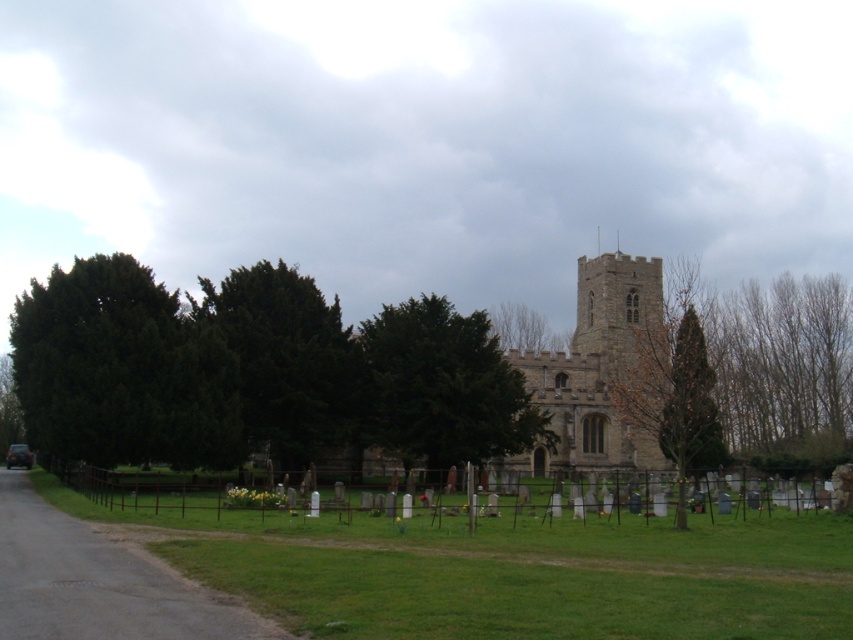
Does green leafy tree at center appear over bare wood at right?

Correct, green leafy tree at center is located above bare wood at right.

Which is below, green leafy tree at center or bare wood at right?

Positioned lower is bare wood at right.

This screenshot has width=853, height=640. I want to click on green leafy tree at center, so click(442, 387).

Identify the location of green leafy tree at center. This screenshot has height=640, width=853. (442, 387).

Between gray stone church at center and green leafy tree at left, which one appears on the right side from the viewer's perspective?

Positioned to the right is gray stone church at center.

The width and height of the screenshot is (853, 640). What do you see at coordinates (599, 371) in the screenshot?
I see `gray stone church at center` at bounding box center [599, 371].

Identify the location of gray stone church at center. (599, 371).

Is gray stone church at center positioned behind dark green textured tree at center?

No, it is in front of dark green textured tree at center.

I want to click on gray stone church at center, so pos(599,371).